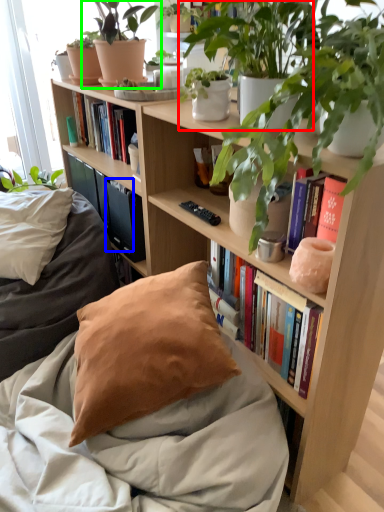
Question: Which object is positioned closest to houseplant (highlighted by a red box)? Select from paperback book (highlighted by a blue box) and houseplant (highlighted by a green box).

Choices:
 (A) paperback book
 (B) houseplant

Answer: (B)